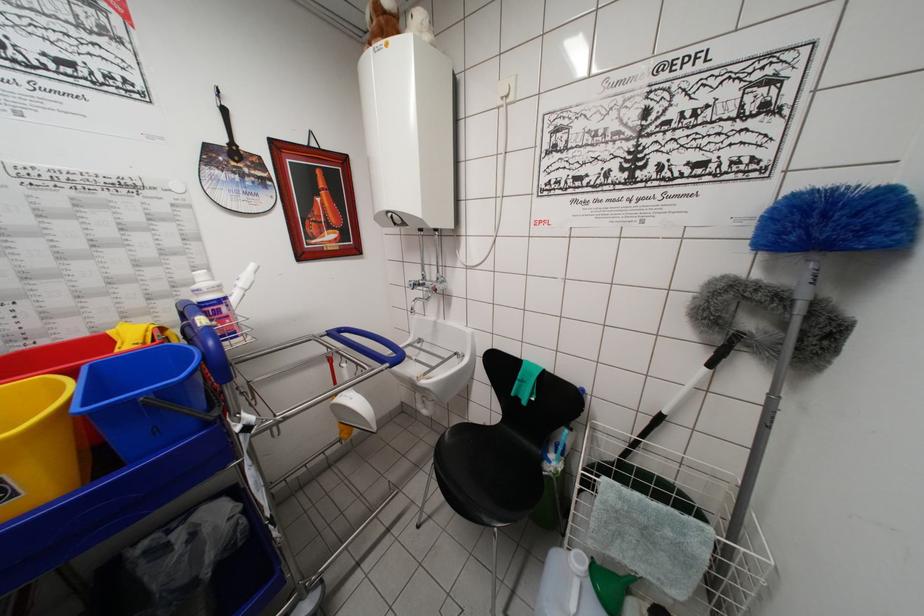
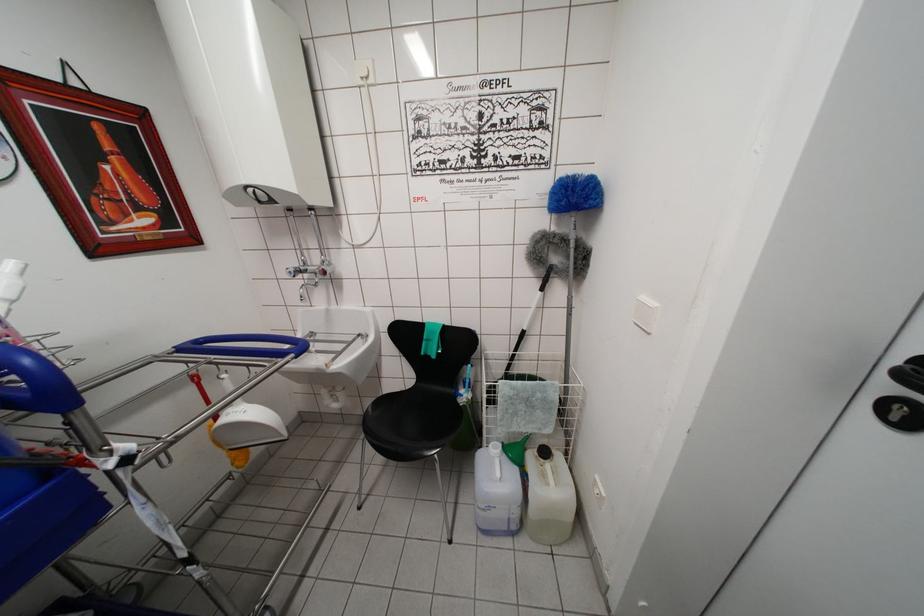
In the second image, find the point that corresponds to (414,290) in the first image.

(293, 277)